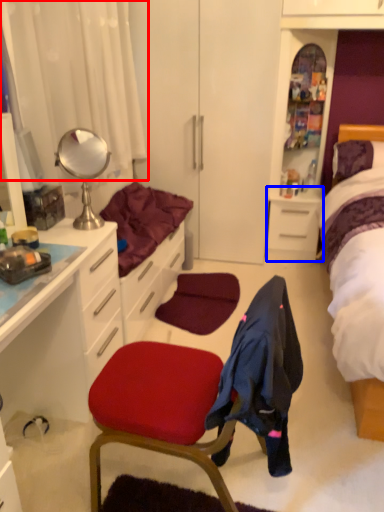
Question: Which point is closer to the camera, curtain (highlighted by a red box) or file cabinet (highlighted by a blue box)?

Choices:
 (A) curtain
 (B) file cabinet

Answer: (A)